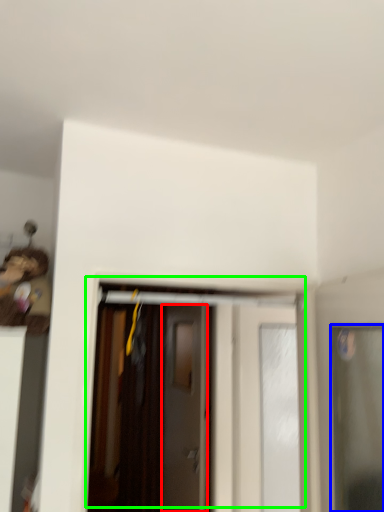
Question: Considering the real-world distances, which object is farthest from door (highlighted by a red box)? door (highlighted by a blue box) or door (highlighted by a green box)?

Choices:
 (A) door
 (B) door

Answer: (A)